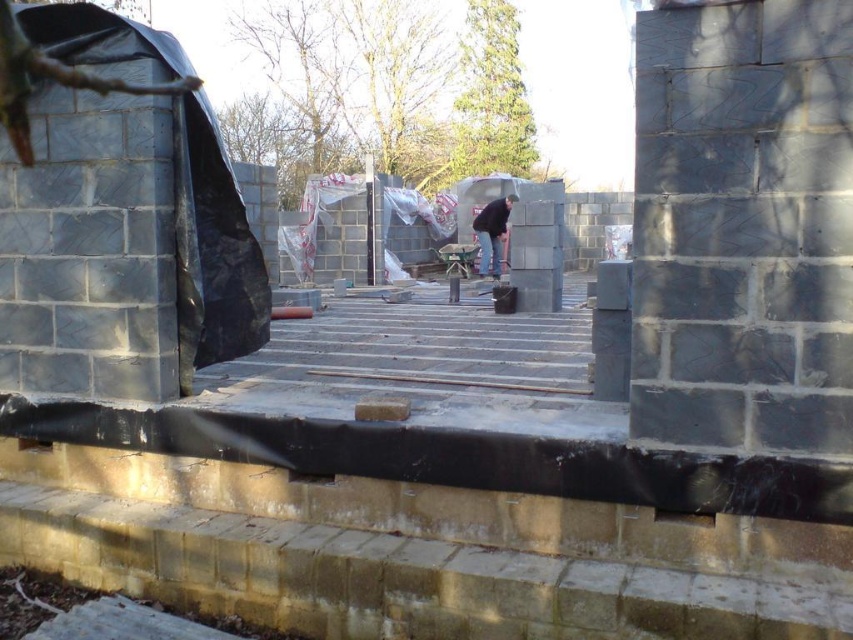
This screenshot has width=853, height=640. What do you see at coordinates (421, 348) in the screenshot?
I see `smooth concrete stairs at center` at bounding box center [421, 348].

Which is in front, point (212, 388) or point (480, 237)?

Point (212, 388) is more forward.

Identify the location of smooth concrete stairs at center. (421, 348).